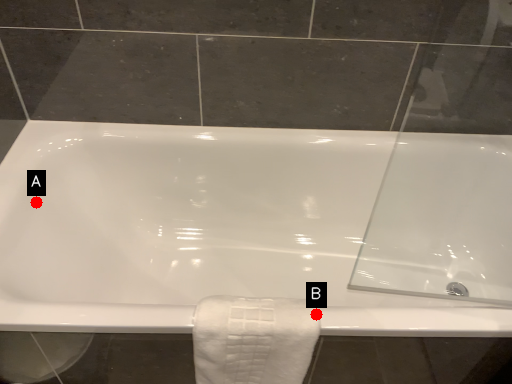
Question: Two points are circled on the image, labeled by A and B beside each circle. Which point is further to the camera?

Choices:
 (A) A is further
 (B) B is further

Answer: (A)